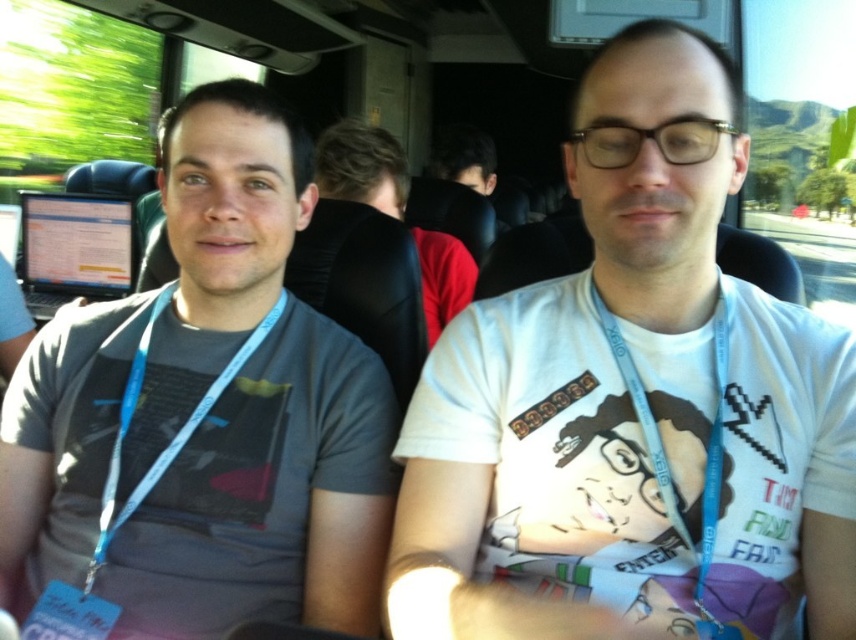
Question: Which point appears closest to the camera in this image?

Choices:
 (A) (43, 342)
 (B) (384, 208)
 (C) (690, 56)
 (D) (140, 481)

Answer: (C)

Question: Which point appears closest to the camera in this image?

Choices:
 (A) coord(152,472)
 (B) coord(340,125)
 (C) coord(84,532)

Answer: (A)

Question: Which point appears farthest from the camera in this image?

Choices:
 (A) click(x=459, y=307)
 (B) click(x=284, y=241)
 (C) click(x=191, y=416)
 (D) click(x=831, y=342)

Answer: (A)

Question: Does dark brown leather jacket at center have a smaller size compared to blue fabric lanyard at left?

Choices:
 (A) no
 (B) yes

Answer: (A)

Question: Does white cotton t-shirt at center have a smaller size compared to dark brown leather jacket at center?

Choices:
 (A) no
 (B) yes

Answer: (B)

Question: Is white cotton t-shirt at center wider than blue fabric lanyard at left?

Choices:
 (A) no
 (B) yes

Answer: (B)